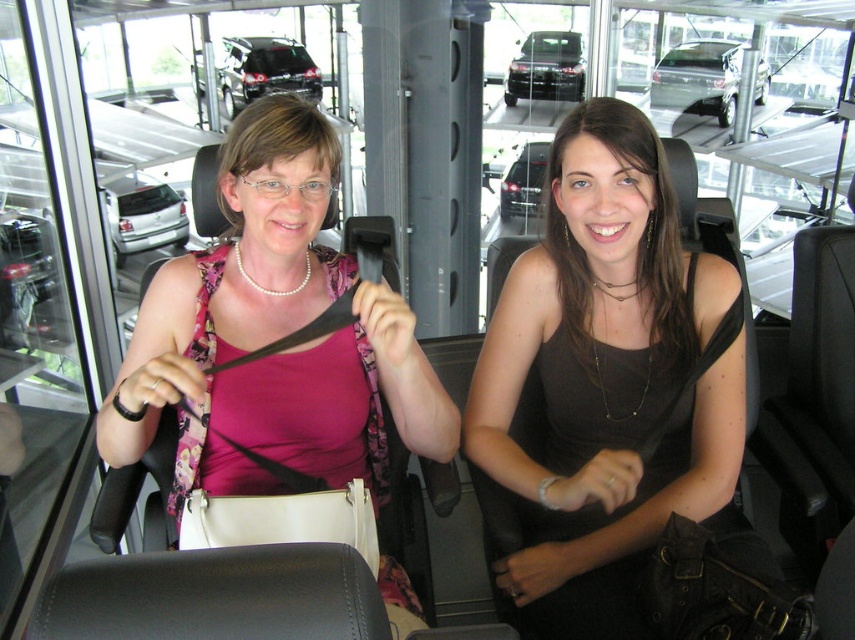
Where is the matte black tank top at center located in the image?

The matte black tank top at center is located at point coordinates of (606, 380).

You are standing in the car showroom and want to take a photo of the point at coordinates [635,316]. The camera you are using has a minimum focus distance of 1.5 meters. Will the camera be able to focus on the point?

The point at coordinates [635,316] is 1.41 meters away from the camera. Since the minimum focus distance is 1.5 meters, the camera cannot focus on the point because it is too close.